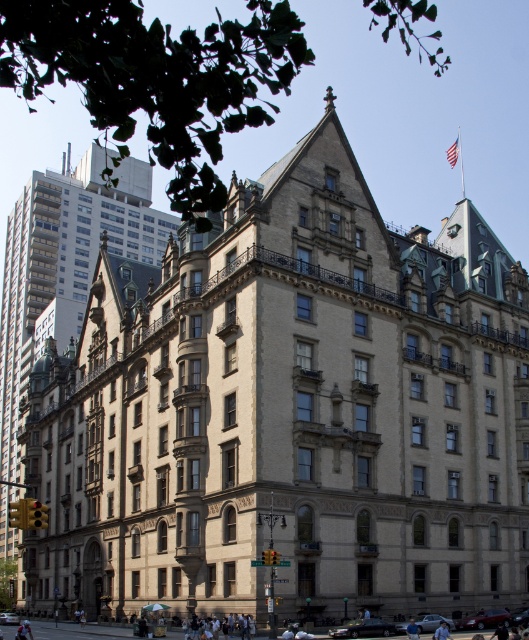
You are standing on the street in front of the grand building. There are two points marked on the building facade. One is at coordinate point [53,180] and the other is at point [4,618]. Which point is closer to you?

Point [53,180] is further to the viewer than point [4,618], so the point closer to you is point [4,618].

You are a delivery person trying to park your delivery van, which is 2 meters tall, in a parking spot near the shiny black sedan at lower center and the silver metallic sedan at lower center. Based on their heights, which sedan should you avoid parking next to to prevent damaging your van?

The shiny black sedan at lower center has a greater height compared to the silver metallic sedan at lower center. Therefore, you should avoid parking next to the shiny black sedan at lower center to prevent damaging your van.